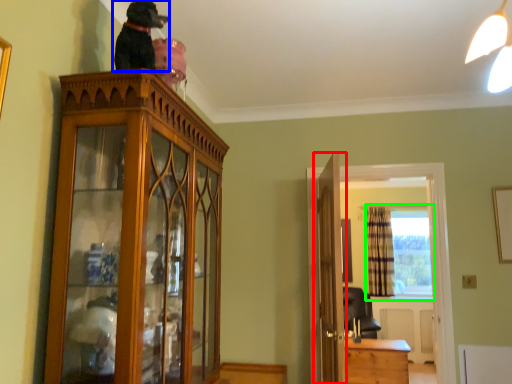
Question: Which is farther away from door (highlighted by a red box)? dog (highlighted by a blue box) or window (highlighted by a green box)?

Choices:
 (A) dog
 (B) window

Answer: (B)